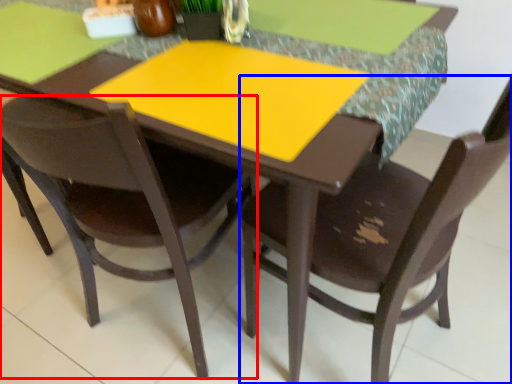
Question: Which point is further to the camera, chair (highlighted by a red box) or chair (highlighted by a blue box)?

Choices:
 (A) chair
 (B) chair

Answer: (A)